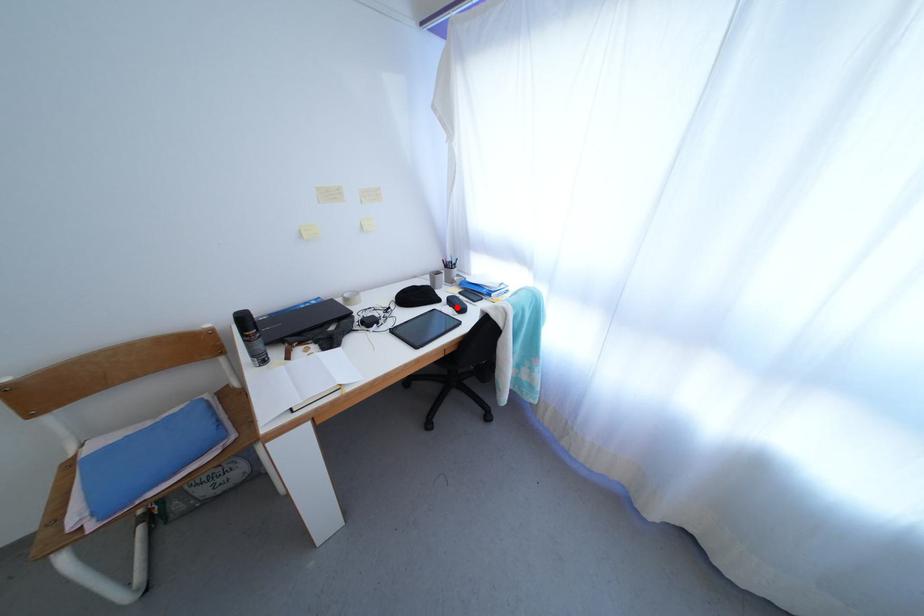
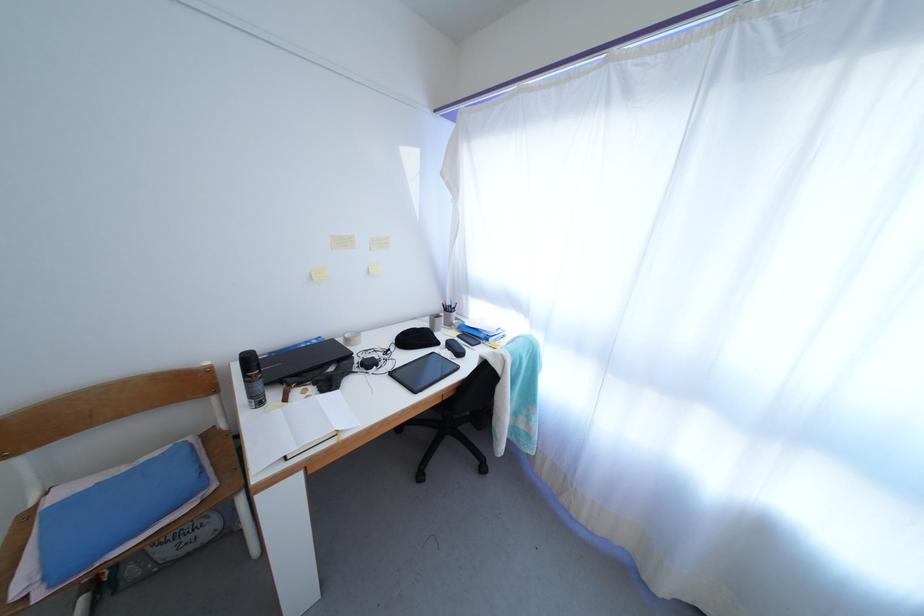
Where in the second image is the point corresponding to the highlighted location from the first image?

(456, 351)